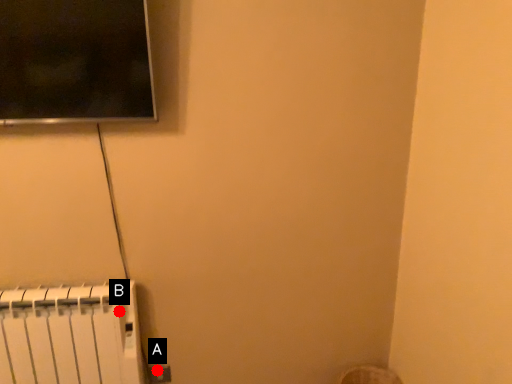
Question: Two points are circled on the image, labeled by A and B beside each circle. Which point is closer to the camera?

Choices:
 (A) A is closer
 (B) B is closer

Answer: (B)